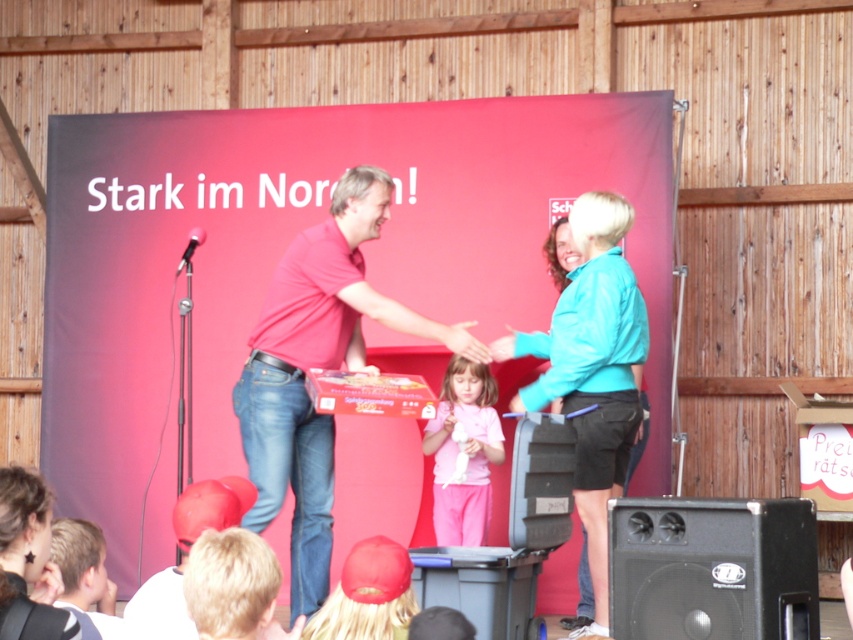
You are standing on the stage and want to place a small gift on the black plastic speaker at lower right. However, there is a matte red cap at lower left in your way. Can you reach the speaker without moving the cap?

The black plastic speaker at lower right is further to the viewer than the matte red cap at lower left, so you can reach it without moving the cap.

From the picture: What object is located at the coordinates point (541, 481)?

The black textured speaker at lower center is located at point (541, 481).